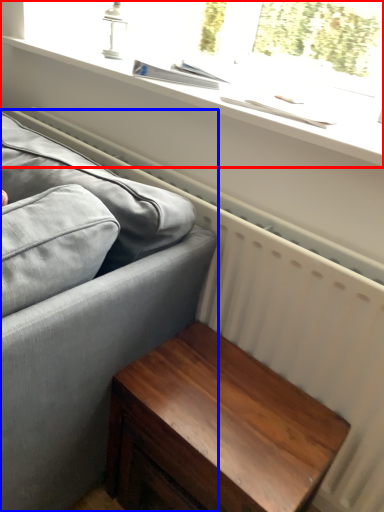
Question: Which of the following is the farthest to the observer, window (highlighted by a red box) or studio couch (highlighted by a blue box)?

Choices:
 (A) window
 (B) studio couch

Answer: (A)